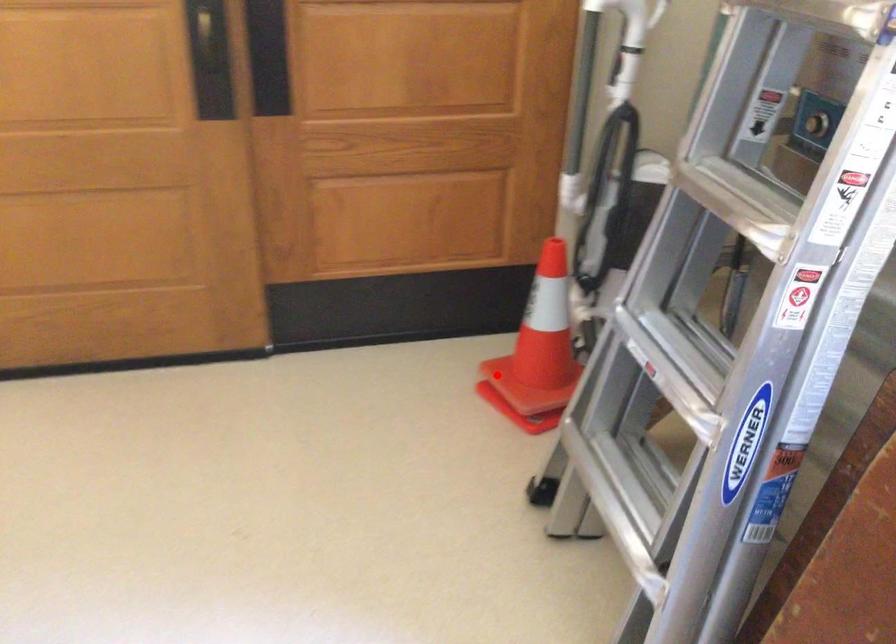
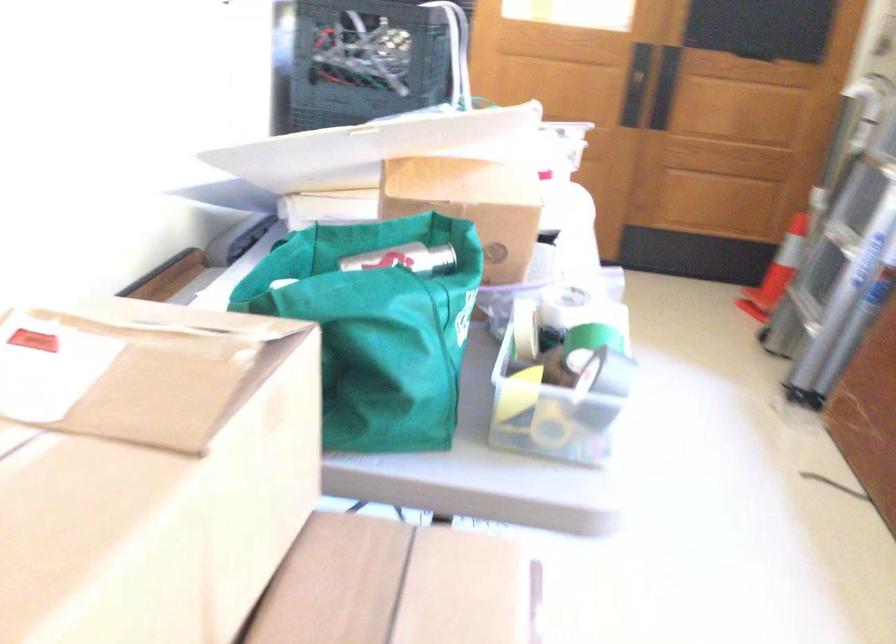
Question: I am providing you with two images of the same scene from different viewpoints. In image1, a red point is highlighted. Considering the same 3D point in image2, which of the following is correct?

Choices:
 (A) It is closer
 (B) It is farther

Answer: (B)